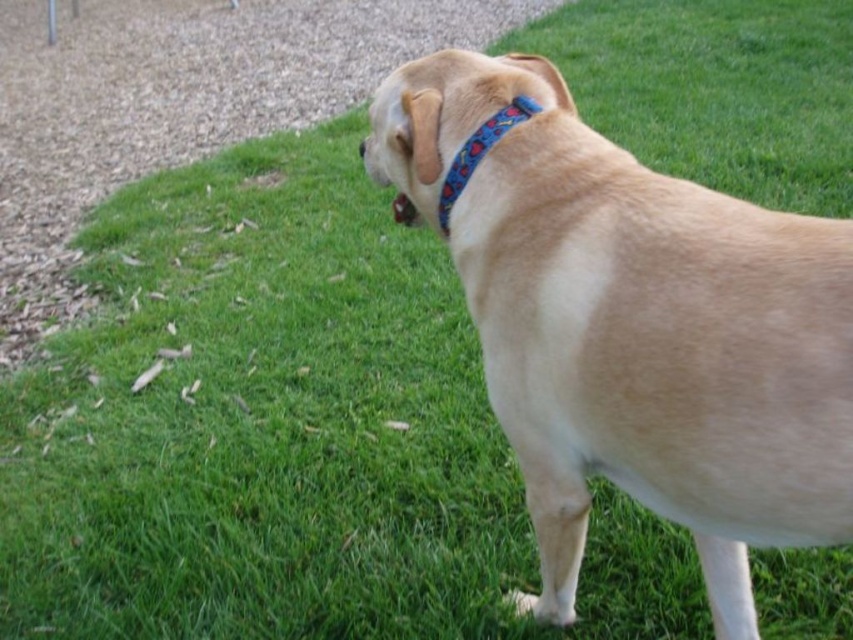
You are a photographer trying to capture the dog in the scene. The light brown fur at center and the blue fabric neckband at upper center are both in your viewfinder. Which object appears wider in the photo?

The light brown fur at center appears wider in the photo because its width is larger than the blue fabric neckband at upper center.

You are a photographer trying to capture the dog in the scene. The light brown fur at center and the blue fabric neckband at upper center are both in your viewfinder. Which object is positioned higher in the image?

The light brown fur at center is much taller than the blue fabric neckband at upper center, so the light brown fur at center is positioned higher in the image.

You are a photographer trying to capture the light brown fur at center in the image. What are the coordinates where you should focus your camera?

The coordinates for the light brown fur at center are at point (633, 326).